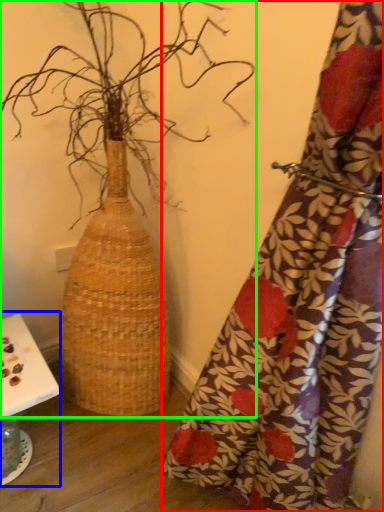
Question: Estimate the real-world distances between objects in this image. Which object is closer to curtain (highlighted by a red box), table (highlighted by a blue box) or houseplant (highlighted by a green box)?

Choices:
 (A) table
 (B) houseplant

Answer: (B)